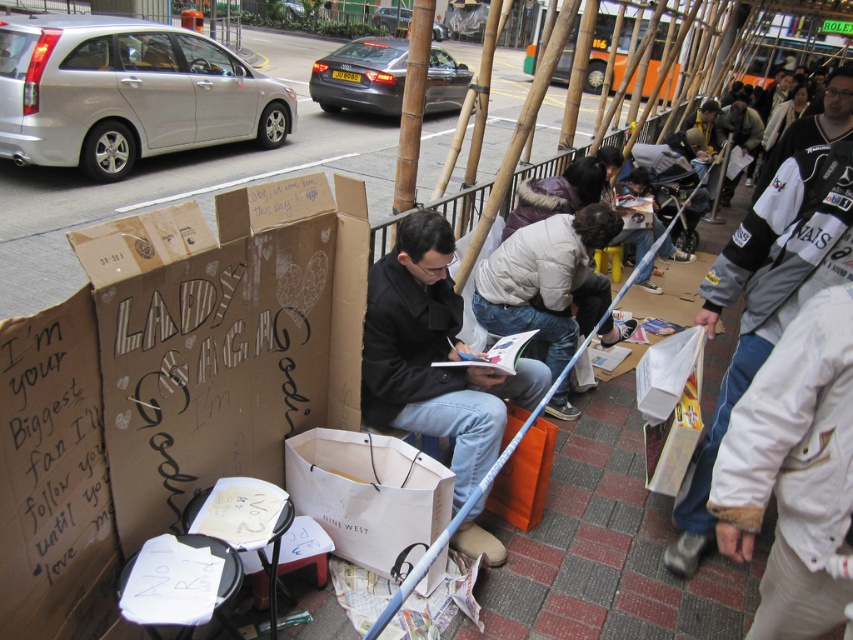
Question: Based on their relative distances, which object is nearer to the black matte jacket at center?

Choices:
 (A) gray fleece jacket at right
 (B) cardboard box at center

Answer: (B)

Question: Is cardboard box at center smaller than gray fleece jacket at right?

Choices:
 (A) yes
 (B) no

Answer: (B)

Question: Which object appears farthest from the camera in this image?

Choices:
 (A) gray fleece jacket at right
 (B) black matte jacket at center
 (C) cardboard box at center

Answer: (B)

Question: Is cardboard box at center to the right of gray fleece jacket at right from the viewer's perspective?

Choices:
 (A) yes
 (B) no

Answer: (B)

Question: Does cardboard box at center lie in front of gray fleece jacket at right?

Choices:
 (A) no
 (B) yes

Answer: (B)

Question: Which object appears closest to the camera in this image?

Choices:
 (A) cardboard box at center
 (B) black matte jacket at center

Answer: (A)